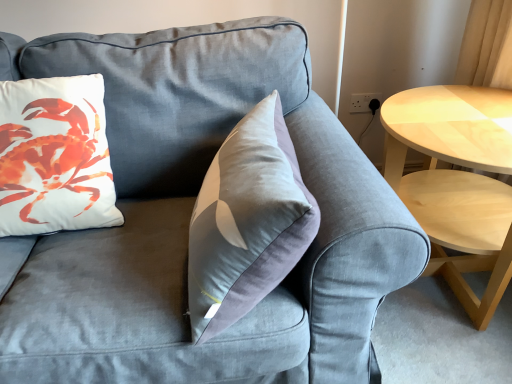
Question: In terms of height, does light wood/woodenobject at right look taller or shorter compared to white matte pillow at upper left?

Choices:
 (A) short
 (B) tall

Answer: (A)

Question: Is light wood/woodenobject at right spatially inside white matte pillow at upper left, or outside of it?

Choices:
 (A) inside
 (B) outside

Answer: (B)

Question: From the image's perspective, is light wood/woodenobject at right above or below white matte pillow at upper left?

Choices:
 (A) above
 (B) below

Answer: (B)

Question: In terms of width, does white matte pillow at upper left look wider or thinner when compared to light wood/woodenobject at right?

Choices:
 (A) wide
 (B) thin

Answer: (B)

Question: Relative to light wood/woodenobject at right, is white matte pillow at upper left in front or behind?

Choices:
 (A) front
 (B) behind

Answer: (A)

Question: Choose the correct answer: Is white matte pillow at upper left inside light wood/woodenobject at right or outside it?

Choices:
 (A) inside
 (B) outside

Answer: (B)

Question: From the image's perspective, is white matte pillow at upper left above or below light wood/woodenobject at right?

Choices:
 (A) above
 (B) below

Answer: (A)